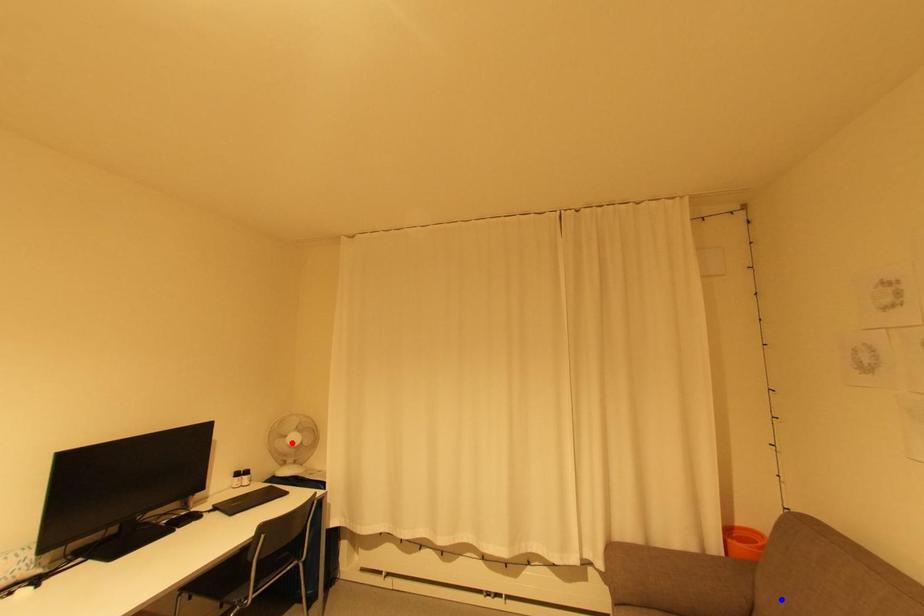
Question: In the image, two points are highlighted. Which point is nearer to the camera? Reply with the corresponding letter.

Choices:
 (A) blue point
 (B) red point

Answer: (A)